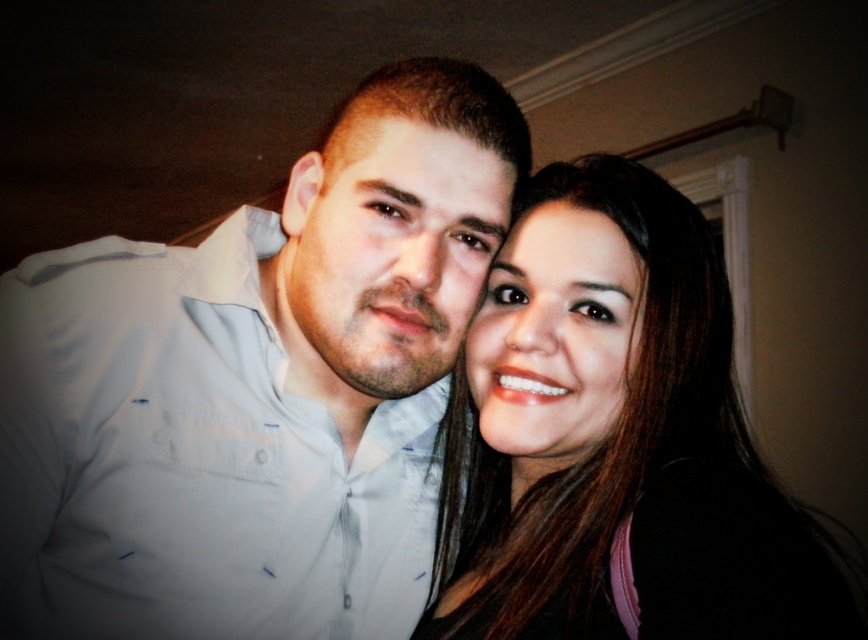
You are a photographer adjusting the lighting for a portrait. You notice the white shirt at center and the smooth brown hair at center. Which object should you focus on first if you want to ensure the larger one is properly lit?

The smooth brown hair at center is larger than the white shirt at center, so you should focus on lighting the smooth brown hair at center first to ensure proper exposure.